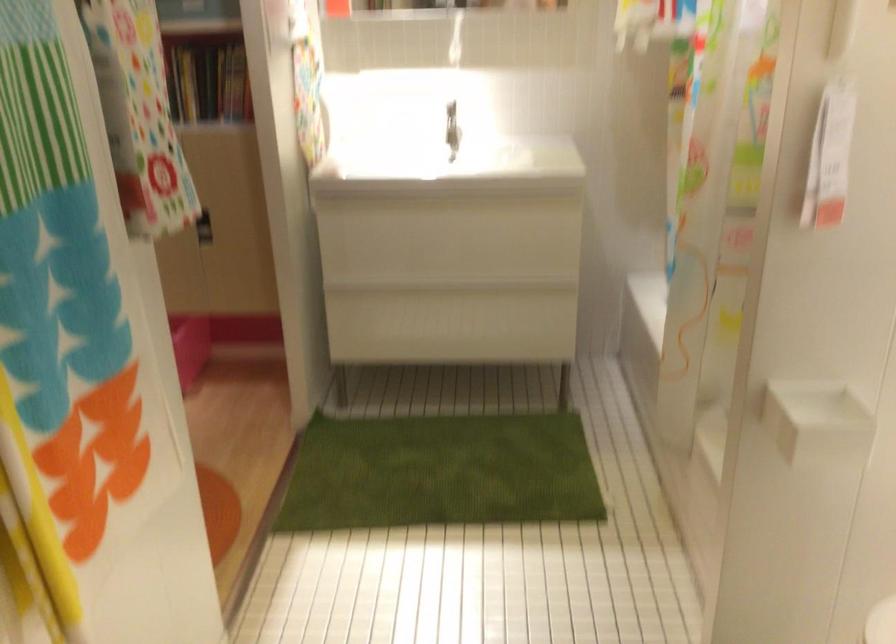
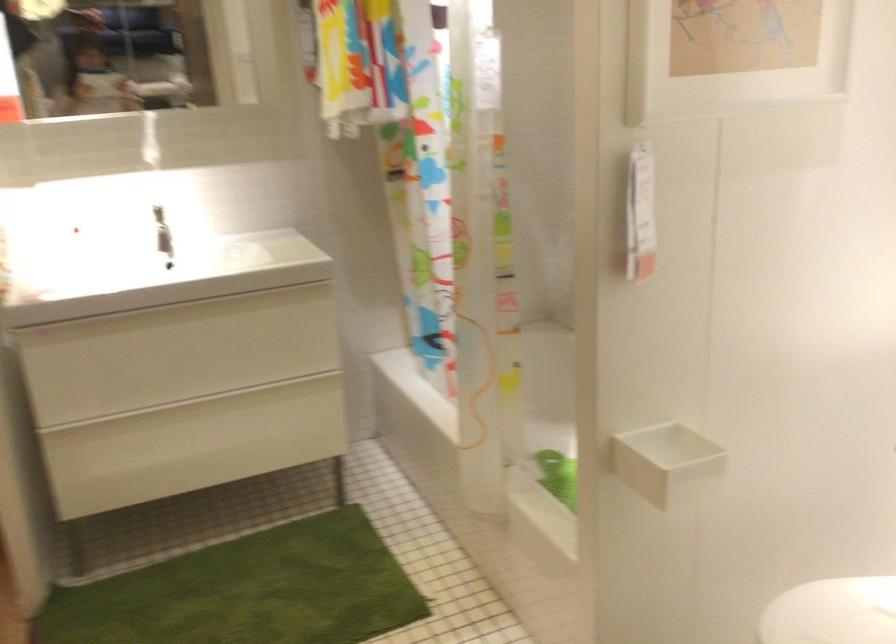
Question: How did the camera likely rotate?

Choices:
 (A) Left
 (B) Right
 (C) Up
 (D) Down

Answer: (B)